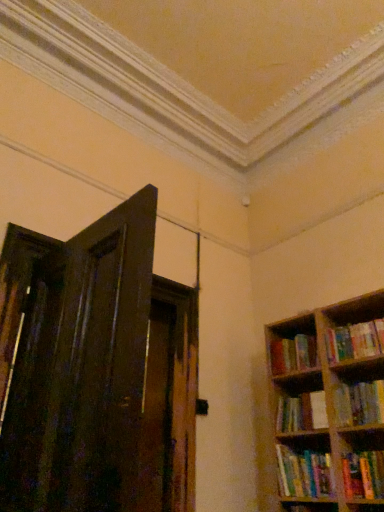
Question: Is dark wood door at left completely or partially inside hardcover book at right, marked as the third book in a bottom-to-top arrangement?

Choices:
 (A) no
 (B) yes

Answer: (A)

Question: Can we say hardcover book at right, marked as the third book in a bottom-to-top arrangement, lies outside dark wood door at left?

Choices:
 (A) yes
 (B) no

Answer: (A)

Question: Does hardcover book at right, marked as the third book in a bottom-to-top arrangement, turn towards dark wood door at left?

Choices:
 (A) yes
 (B) no

Answer: (A)

Question: Considering the relative positions of hardcover book at right, marked as the third book in a bottom-to-top arrangement, and dark wood door at left in the image provided, is hardcover book at right, marked as the third book in a bottom-to-top arrangement, to the right of dark wood door at left from the viewer's perspective?

Choices:
 (A) no
 (B) yes

Answer: (B)

Question: From a real-world perspective, is hardcover book at right, placed as the third book when sorted from top to bottom, beneath dark wood door at left?

Choices:
 (A) yes
 (B) no

Answer: (A)

Question: Considering the relative sizes of hardcover book at right, marked as the third book in a bottom-to-top arrangement, and dark wood door at left in the image provided, is hardcover book at right, marked as the third book in a bottom-to-top arrangement, smaller than dark wood door at left?

Choices:
 (A) yes
 (B) no

Answer: (A)

Question: Can you confirm if multicolored paperbacks at right, the 4th book from the bottom, is thinner than hardcover books at right, which is the 1th book from top to bottom?

Choices:
 (A) no
 (B) yes

Answer: (A)

Question: Is multicolored paperbacks at right, the 4th book from the bottom, aimed at hardcover books at right, which is the 1th book from top to bottom?

Choices:
 (A) no
 (B) yes

Answer: (A)

Question: Is multicolored paperbacks at right, the 4th book from the bottom, bigger than hardcover books at right, the fifth book in the bottom-to-top sequence?

Choices:
 (A) yes
 (B) no

Answer: (A)

Question: From a real-world perspective, does multicolored paperbacks at right, acting as the 2th book starting from the top, stand above hardcover books at right, the fifth book in the bottom-to-top sequence?

Choices:
 (A) no
 (B) yes

Answer: (B)

Question: Is multicolored paperbacks at right, the 4th book from the bottom, positioned with its back to hardcover books at right, which is the 1th book from top to bottom?

Choices:
 (A) yes
 (B) no

Answer: (B)

Question: Is multicolored paperbacks at right, the 4th book from the bottom, beside hardcover books at right, the fifth book in the bottom-to-top sequence?

Choices:
 (A) yes
 (B) no

Answer: (B)

Question: From the image's perspective, is hardcover book at right, placed as the third book when sorted from top to bottom, below hardcover books at right, which is the 1th book from top to bottom?

Choices:
 (A) no
 (B) yes

Answer: (B)